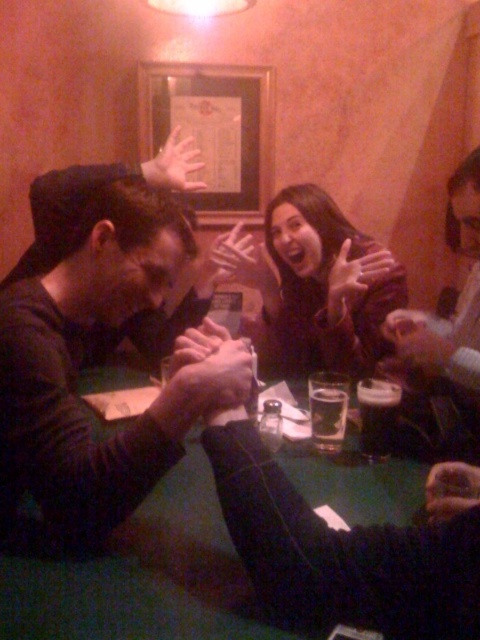
Does smooth skin hand at center come in front of matte black hand at upper center?

Yes, smooth skin hand at center is in front of matte black hand at upper center.

Between smooth skin hand at center and matte black hand at upper center, which one is positioned higher?

matte black hand at upper center is higher up.

Between point (181, 340) and point (377, 252), which one is positioned behind?

The point (377, 252) is behind.

Where is `smooth skin hand at center`? This screenshot has height=640, width=480. smooth skin hand at center is located at coordinates (214, 372).

Does point (396, 266) come in front of point (389, 426)?

No.

Who is more distant from viewer, (332, 282) or (384, 452)?

The point (332, 282) is more distant.

Is point (352, 342) in front of point (360, 424)?

No, (352, 342) is behind (360, 424).

At what (x,y) coordinates should I click in order to perform the action: click on dark brown hair at center. Please return your answer as a coordinate pair (x, y). The image size is (480, 640). Looking at the image, I should click on (323, 284).

Does smooth leather jacket at upper right have a larger size compared to translucent plastic hand at center?

Yes.

Between smooth leather jacket at upper right and translucent plastic hand at center, which one is positioned higher?

translucent plastic hand at center is higher up.

Is point (462, 371) more distant than point (153, 182)?

No, (462, 371) is in front of (153, 182).

The width and height of the screenshot is (480, 640). I want to click on smooth leather jacket at upper right, so click(448, 326).